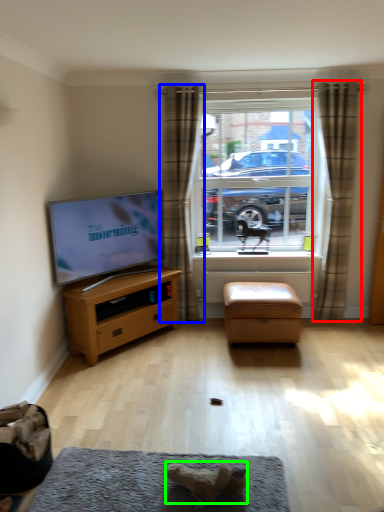
Question: Which object is positioned closest to curtain (highlighted by a red box)? Select from curtain (highlighted by a blue box) and animal (highlighted by a green box).

Choices:
 (A) curtain
 (B) animal

Answer: (A)